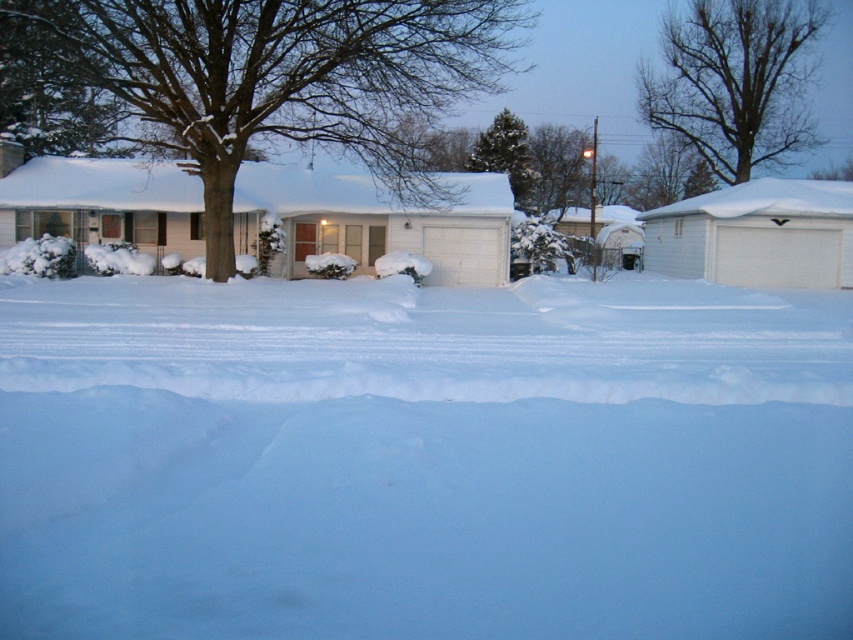
You are a delivery person trying to reach the front porch of the house. There are two landmarks visible in the scene, a brown textured tree at center and bare branches at upper center. Which landmark should you use to navigate towards the porch?

The brown textured tree at center is positioned under bare branches at upper center, so you should navigate towards the brown textured tree at center since it is closer to the porch.

You are a delivery person trying to reach the front porch of the house. You see the white fluffy snow at center and the brown textured tree at center. Which object is closer to the ground?

The white fluffy snow at center is shorter than the brown textured tree at center, so the white fluffy snow at center is closer to the ground.

You are a delivery person trying to park your car between the brown textured tree at center and the green textured pine tree at upper center. Can you fit your car there if your car is 2 meters wide?

The brown textured tree at center is wider than the green textured pine tree at upper center. However, the exact width difference isn not specified, so it is uncertain whether the space between them can accommodate a 2 meter wide car. More information about the distance between the trees is needed to determine this.